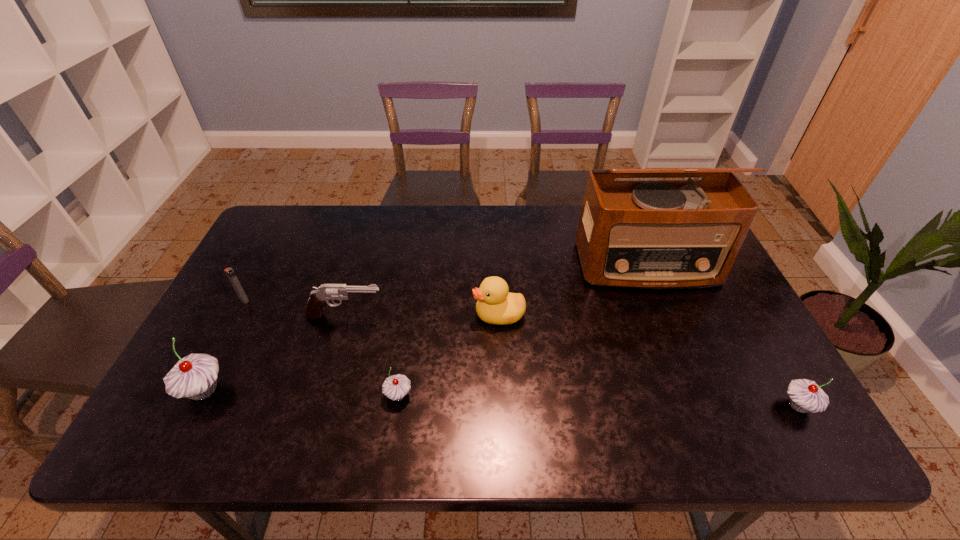
The image size is (960, 540). Find the location of `location for an additional cupcake to make spacing equal`. location for an additional cupcake to make spacing equal is located at coordinates (596, 400).